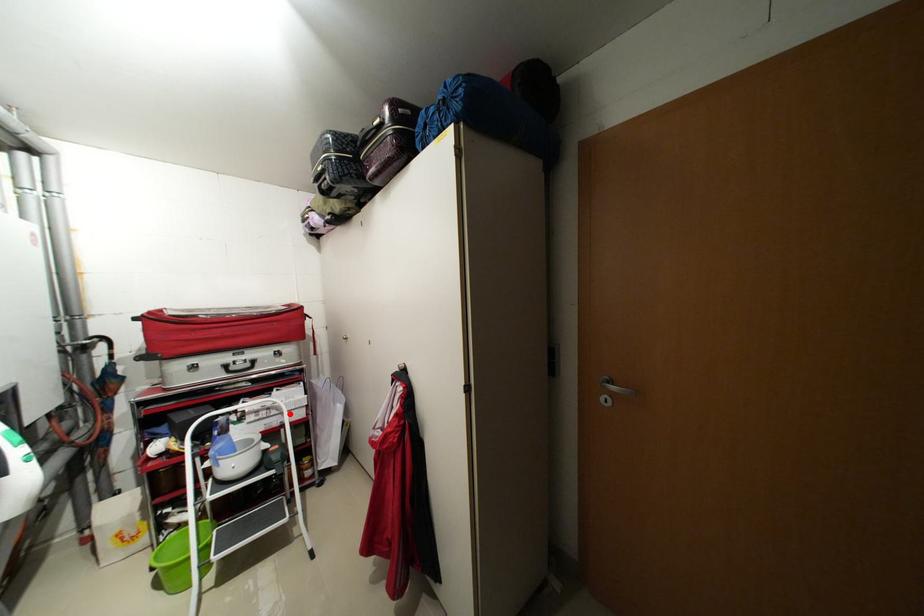
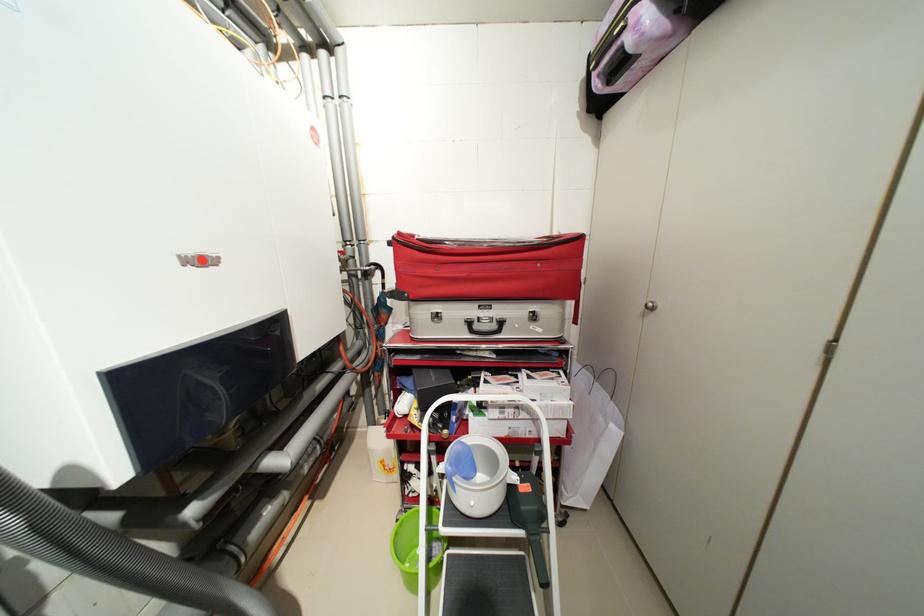
Question: I am providing you with two images of the same scene from different viewpoints. Given a red point in image1, look at the same physical point in image2. Is it:

Choices:
 (A) Closer to the viewpoint
 (B) Farther from the viewpoint

Answer: (B)